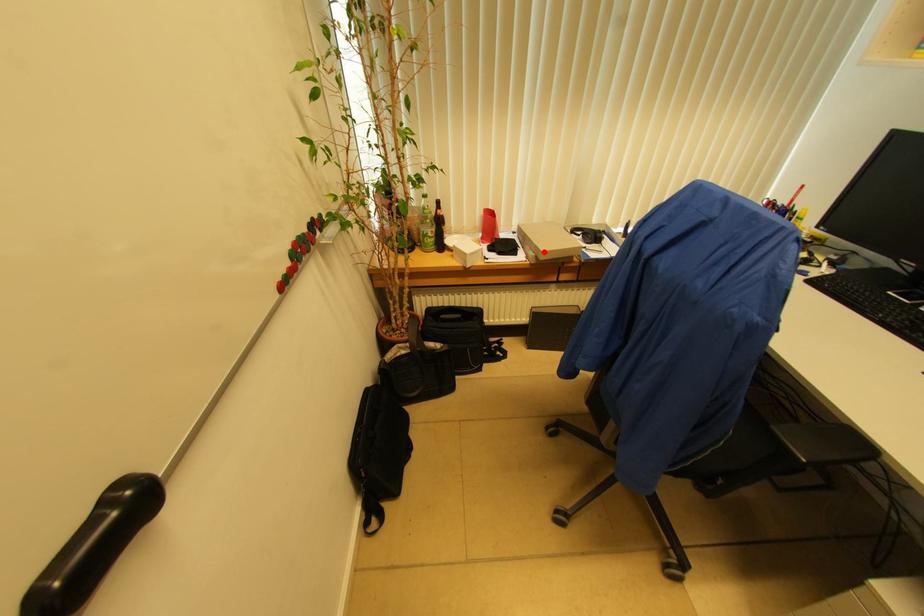
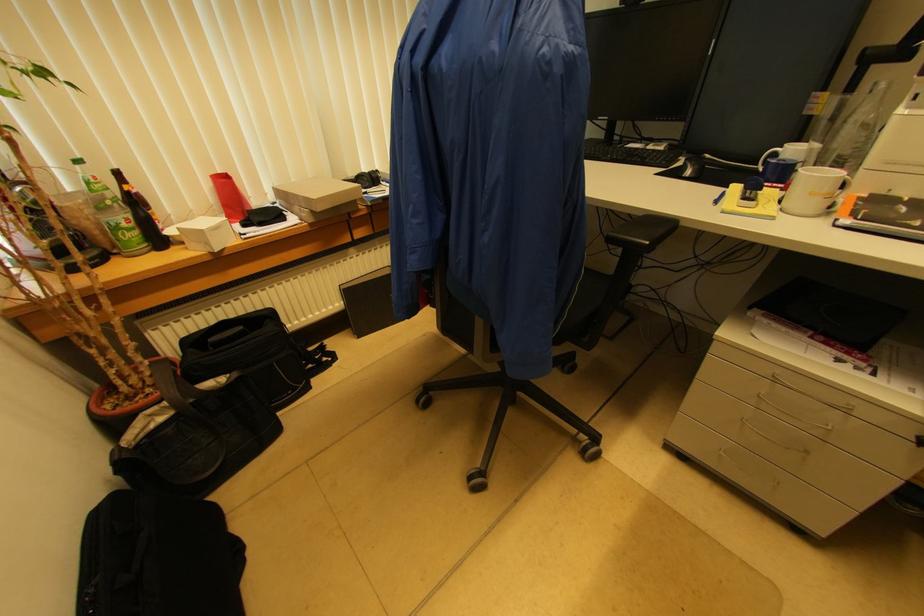
In the second image, find the point that corresponds to the highlighted location in the first image.

(315, 200)